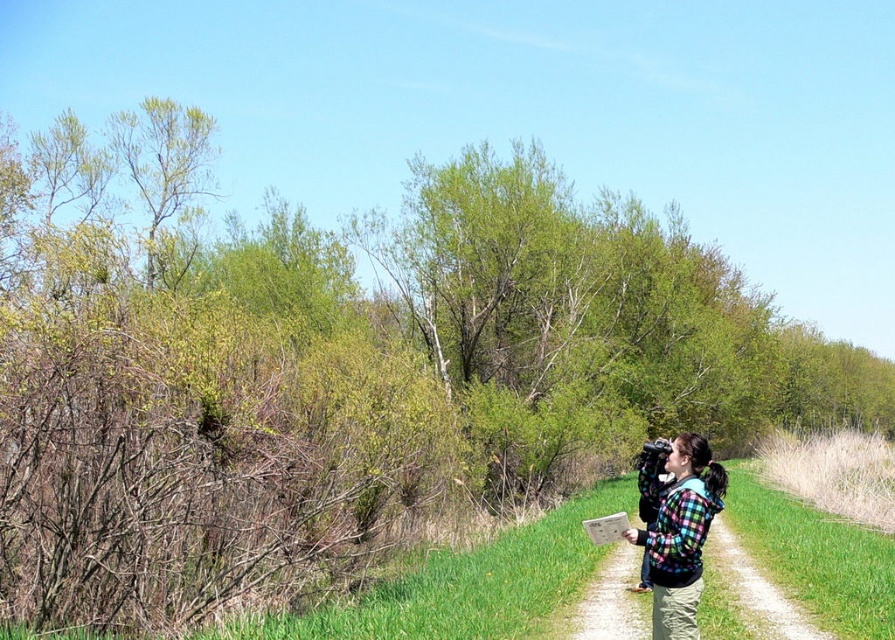
Is point (273, 632) positioned before point (655, 531)?

No, (273, 632) is further to viewer.

Does green grass at lower center lie in front of plaid fleece jacket at right?

No, it is not.

Measure the distance between green grass at lower center and camera.

25.68 feet

I want to click on green grass at lower center, so click(467, 586).